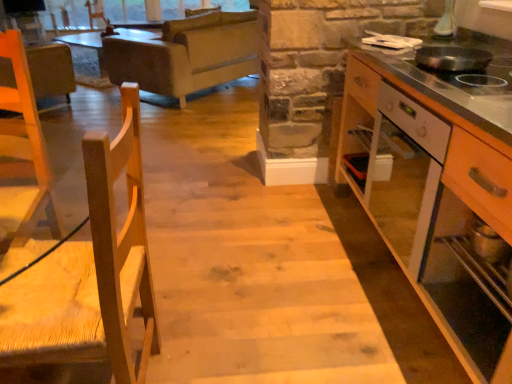
Where is `vacant region to the left of wooden cabinet at right`? vacant region to the left of wooden cabinet at right is located at coordinates (270, 276).